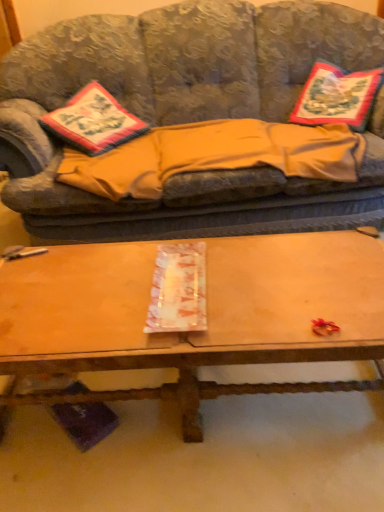
The image size is (384, 512). Find the location of `beige fleece blanket at center`. beige fleece blanket at center is located at coordinates (215, 155).

I want to click on textured fabric couch at center, so click(183, 112).

Describe the element at coordinates (93, 121) in the screenshot. I see `embroidered fabric pillow at left` at that location.

Image resolution: width=384 pixels, height=512 pixels. Find the location of `beige fleece blanket at center`. beige fleece blanket at center is located at coordinates (215, 155).

Are wooden at center and textured fabric couch at center making contact?

No, wooden at center is not with textured fabric couch at center.

From the image's perspective, is wooden at center located above or below textured fabric couch at center?

From the image's perspective, wooden at center appears below textured fabric couch at center.

In terms of height, does wooden at center look taller or shorter compared to textured fabric couch at center?

wooden at center is shorter than textured fabric couch at center.

Between wooden at center and textured fabric couch at center, which one appears on the left side from the viewer's perspective?

From the viewer's perspective, wooden at center appears more on the left side.

From the image's perspective, is embroidered fabric pillow at upper right positioned above or below embroidered fabric pillow at left?

Clearly, from the image's perspective, embroidered fabric pillow at upper right is above embroidered fabric pillow at left.

Find the location of a particular element. The height and width of the screenshot is (512, 384). throw pillow located underneath the embroidered fabric pillow at upper right (from a real-world perspective) is located at coordinates (93, 121).

Is point (328, 115) less distant than point (72, 142)?

No, (328, 115) is behind (72, 142).

Can you confirm if embroidered fabric pillow at upper right is thinner than embroidered fabric pillow at left?

Indeed, embroidered fabric pillow at upper right has a lesser width compared to embroidered fabric pillow at left.

Looking at this image, relative to beige fleece blanket at center, is textured fabric couch at center in front or behind?

textured fabric couch at center is in front of beige fleece blanket at center.

Could you tell me if textured fabric couch at center is facing beige fleece blanket at center?

Yes, textured fabric couch at center is facing beige fleece blanket at center.

From the picture: Looking at their sizes, would you say textured fabric couch at center is wider or thinner than beige fleece blanket at center?

In the image, textured fabric couch at center appears to be wider than beige fleece blanket at center.

From a real-world perspective, which is physically below, textured fabric couch at center or beige fleece blanket at center?

beige fleece blanket at center is physically lower.

From a real-world perspective, which is physically above, beige fleece blanket at center or wooden at center?

In real-world perspective, beige fleece blanket at center is above.

Would you say wooden at center is part of beige fleece blanket at center's contents?

No.

Is beige fleece blanket at center taller than wooden at center?

No, beige fleece blanket at center is not taller than wooden at center.

From the image's perspective, does beige fleece blanket at center appear lower than wooden at center?

Actually, beige fleece blanket at center appears above wooden at center in the image.

Based on the photo, in terms of size, does wooden at center appear bigger or smaller than embroidered fabric pillow at upper right?

wooden at center is bigger than embroidered fabric pillow at upper right.

How distant is wooden at center from embroidered fabric pillow at upper right?

1.18 meters.

Are wooden at center and embroidered fabric pillow at upper right beside each other?

No, wooden at center is not beside embroidered fabric pillow at upper right.

Which object is thinner, wooden at center or embroidered fabric pillow at upper right?

With smaller width is embroidered fabric pillow at upper right.

From a real-world perspective, which is physically below, beige fleece blanket at center or embroidered fabric pillow at left?

From a 3D spatial view, beige fleece blanket at center is below.

Does beige fleece blanket at center lie in front of embroidered fabric pillow at left?

Yes, it is.

From the image's perspective, which one is positioned higher, beige fleece blanket at center or embroidered fabric pillow at left?

embroidered fabric pillow at left is shown above in the image.

Choose the correct answer: Is beige fleece blanket at center inside embroidered fabric pillow at left or outside it?

beige fleece blanket at center is not inside embroidered fabric pillow at left, it's outside.

Where is `blanket below the embroidered fabric pillow at upper right (from a real-world perspective)`? blanket below the embroidered fabric pillow at upper right (from a real-world perspective) is located at coordinates (215, 155).

Is embroidered fabric pillow at upper right bigger than beige fleece blanket at center?

No, embroidered fabric pillow at upper right is not bigger than beige fleece blanket at center.

Considering the sizes of objects embroidered fabric pillow at upper right and beige fleece blanket at center in the image provided, who is wider, embroidered fabric pillow at upper right or beige fleece blanket at center?

With larger width is beige fleece blanket at center.

From the image's perspective, is embroidered fabric pillow at upper right beneath beige fleece blanket at center?

Actually, embroidered fabric pillow at upper right appears above beige fleece blanket at center in the image.

Image resolution: width=384 pixels, height=512 pixels. What are the coordinates of `studio couch above the wooden at center (from the image's perspective)` in the screenshot? It's located at (183, 112).

Image resolution: width=384 pixels, height=512 pixels. I want to click on pillow behind the embroidered fabric pillow at left, so click(337, 97).

Estimate the real-world distances between objects in this image. Which object is further from embroidered fabric pillow at left, textured fabric couch at center or wooden at center?

wooden at center lies further to embroidered fabric pillow at left than the other object.

Looking at the image, which one is located further to embroidered fabric pillow at upper right, beige fleece blanket at center or textured fabric couch at center?

textured fabric couch at center.

Based on their spatial positions, is embroidered fabric pillow at left or textured fabric couch at center closer to embroidered fabric pillow at upper right?

Among the two, textured fabric couch at center is located nearer to embroidered fabric pillow at upper right.

Looking at the image, which one is located further to embroidered fabric pillow at left, beige fleece blanket at center or wooden at center?

Among the two, wooden at center is located further to embroidered fabric pillow at left.

Based on the photo, looking at the image, which one is located further to embroidered fabric pillow at upper right, textured fabric couch at center or beige fleece blanket at center?

textured fabric couch at center is further to embroidered fabric pillow at upper right.

Which object lies further to the anchor point wooden at center, beige fleece blanket at center or embroidered fabric pillow at left?

embroidered fabric pillow at left is further to wooden at center.

Estimate the real-world distances between objects in this image. Which object is further from embroidered fabric pillow at left, textured fabric couch at center or beige fleece blanket at center?

textured fabric couch at center lies further to embroidered fabric pillow at left than the other object.

Based on their spatial positions, is textured fabric couch at center or wooden at center closer to embroidered fabric pillow at upper right?

textured fabric couch at center is positioned closer to the anchor embroidered fabric pillow at upper right.

Locate an element on the screen. coffee table between embroidered fabric pillow at left and embroidered fabric pillow at upper right in the horizontal direction is located at coordinates (208, 314).

Identify the location of blanket located between textured fabric couch at center and embroidered fabric pillow at upper right in the left-right direction. Image resolution: width=384 pixels, height=512 pixels. (215, 155).

In order to click on blanket situated between embroidered fabric pillow at left and embroidered fabric pillow at upper right from left to right in this screenshot , I will do `click(215, 155)`.

This screenshot has width=384, height=512. I want to click on blanket between textured fabric couch at center and wooden at center in the vertical direction, so click(215, 155).